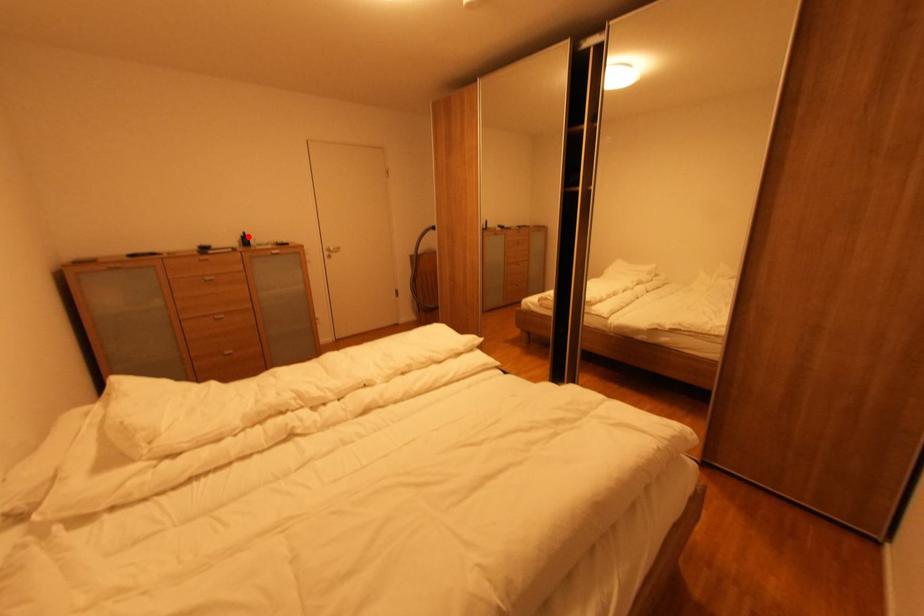
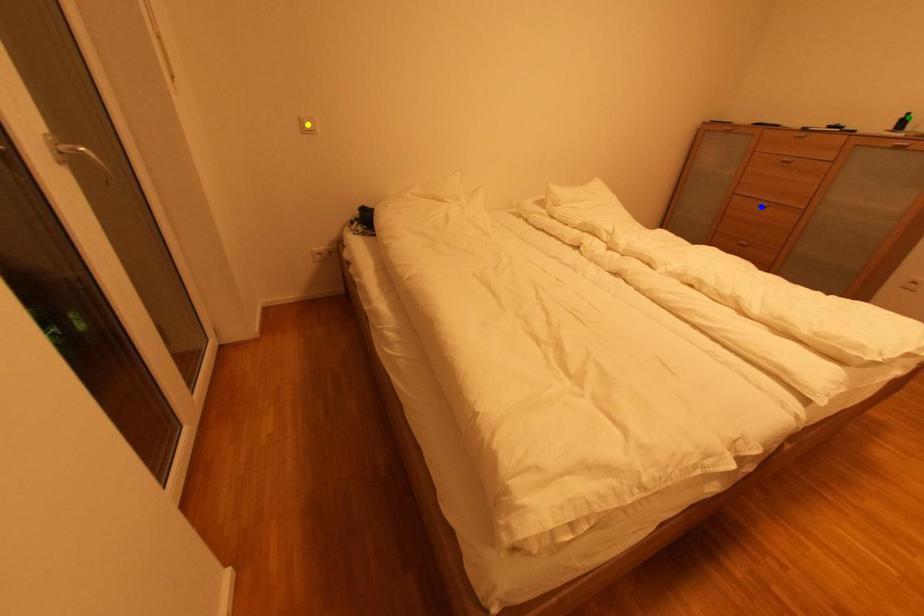
Question: I am providing you with two images of the same scene from different viewpoints. A red point is marked on the first image. You are given multiple points on the second image. Which point in image 2 represents the same 3d spot as the red point in image 1?

Choices:
 (A) blue point
 (B) green point
 (C) yellow point

Answer: (B)